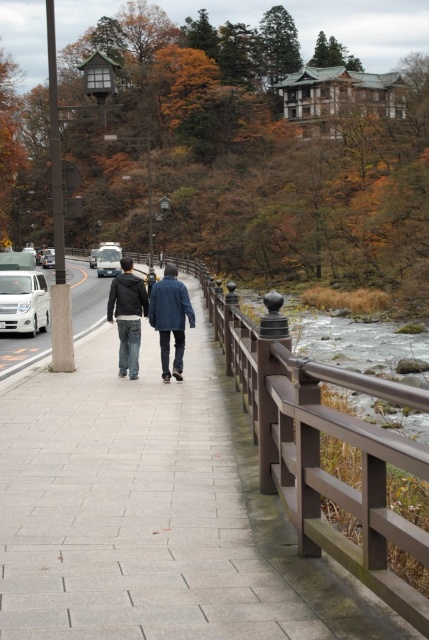
You are standing at the starting point of the pathway and want to locate the denim jacket at center. According to the coordinates provided, where should you look relative to your position?

The denim jacket at center is located at coordinates 0.495 on the x axis and 0.345 on the y axis relative to your position.